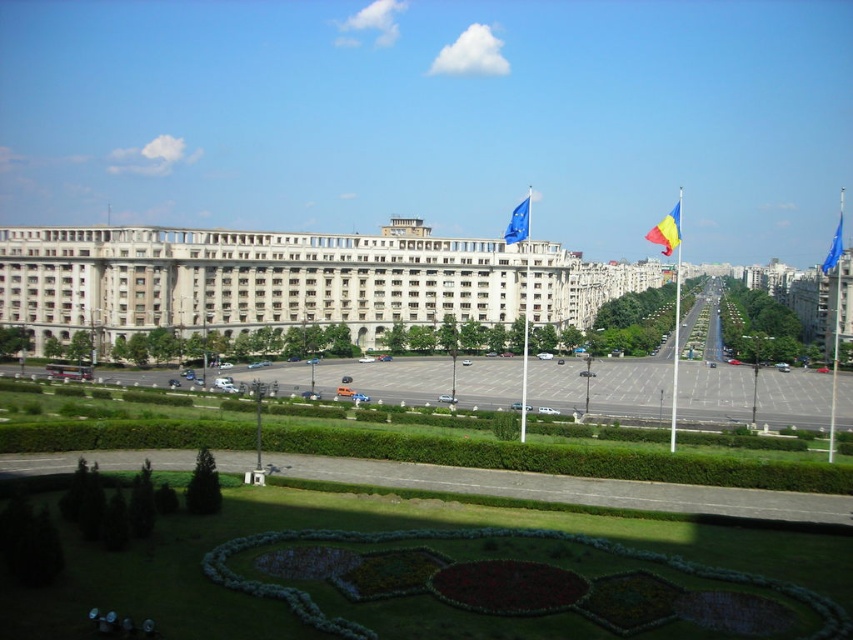
You are standing in the urban landscape looking at the large building. There are two points marked in the scene, one at coordinate point (527, 211) and another at point (831, 260). Which point is closer to you?

Point (527, 211) is closer to the viewer than point (831, 260).

You are standing at the entrance of the large classical building and see the point marked as point (x=518, y=221). What object is located at this point?

The blue fabric flag at center is located at point (x=518, y=221).

From the picture: You are a visitor arriving at the building and notice two flags. Which flag is positioned to the left when looking at the yellow and blue fabric flag at upper right and the blue fabric flag at right?

The yellow and blue fabric flag at upper right is positioned to the left of the blue fabric flag at right.